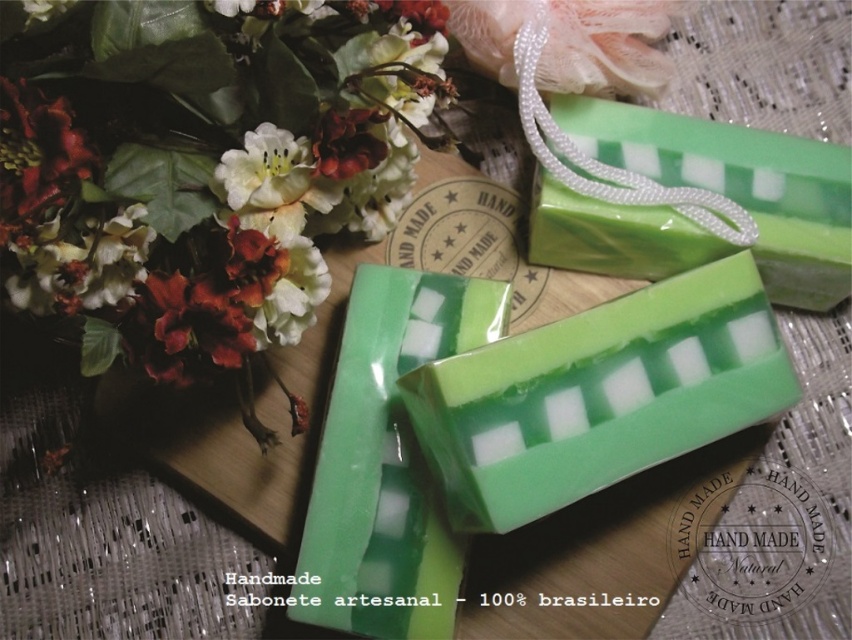
Can you confirm if matte floral bouquet at upper left is positioned below green matte soap at upper right?

Indeed, matte floral bouquet at upper left is positioned under green matte soap at upper right.

Which is in front, point (200, 273) or point (672, 113)?

Point (200, 273) is in front.

This screenshot has width=852, height=640. Describe the element at coordinates (202, 164) in the screenshot. I see `matte floral bouquet at upper left` at that location.

I want to click on matte floral bouquet at upper left, so point(202,164).

Who is more forward, (128, 321) or (773, 381)?

Positioned in front is point (128, 321).

Between matte floral bouquet at upper left and green translucent soap at center, which one has more height?

Standing taller between the two is matte floral bouquet at upper left.

This screenshot has height=640, width=852. What do you see at coordinates (202, 164) in the screenshot? I see `matte floral bouquet at upper left` at bounding box center [202, 164].

Find the location of a particular element. This screenshot has height=640, width=852. matte floral bouquet at upper left is located at coordinates (202, 164).

The image size is (852, 640). Identify the location of green translucent soap at center. point(599,394).